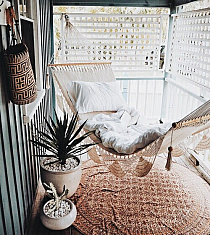
At what (x,y) coordinates should I click in order to perform the action: click on hook. Please return your answer as a coordinate pair (x, y). The height and width of the screenshot is (235, 210). Looking at the image, I should click on (6, 4).